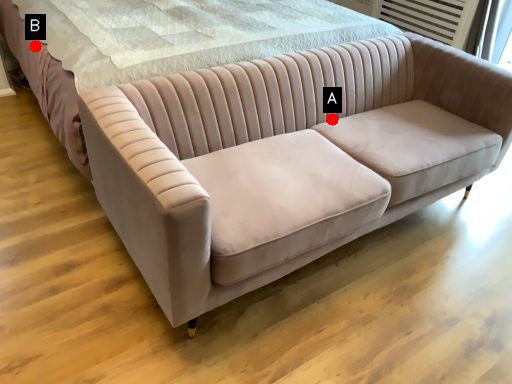
Question: Two points are circled on the image, labeled by A and B beside each circle. Which point is closer to the camera?

Choices:
 (A) A is closer
 (B) B is closer

Answer: (A)